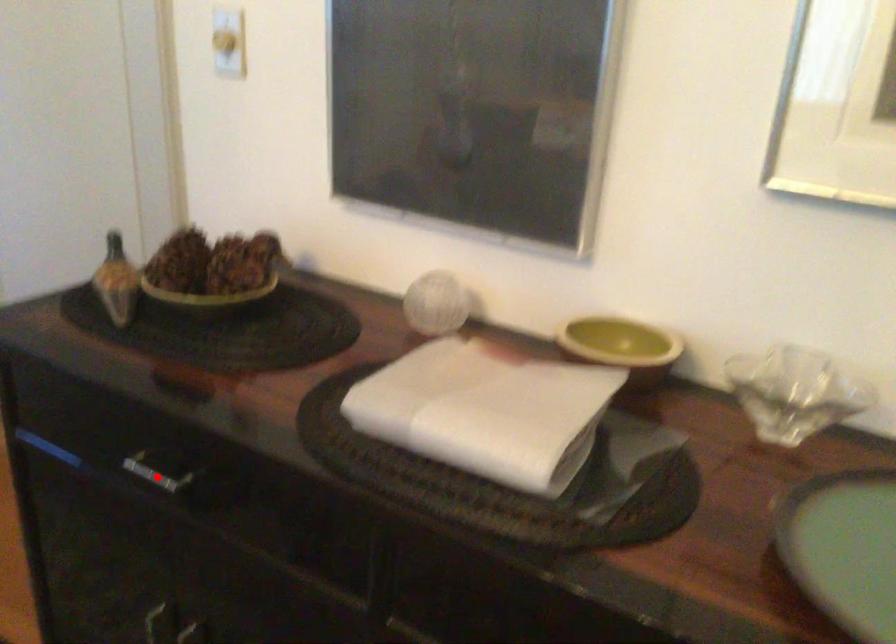
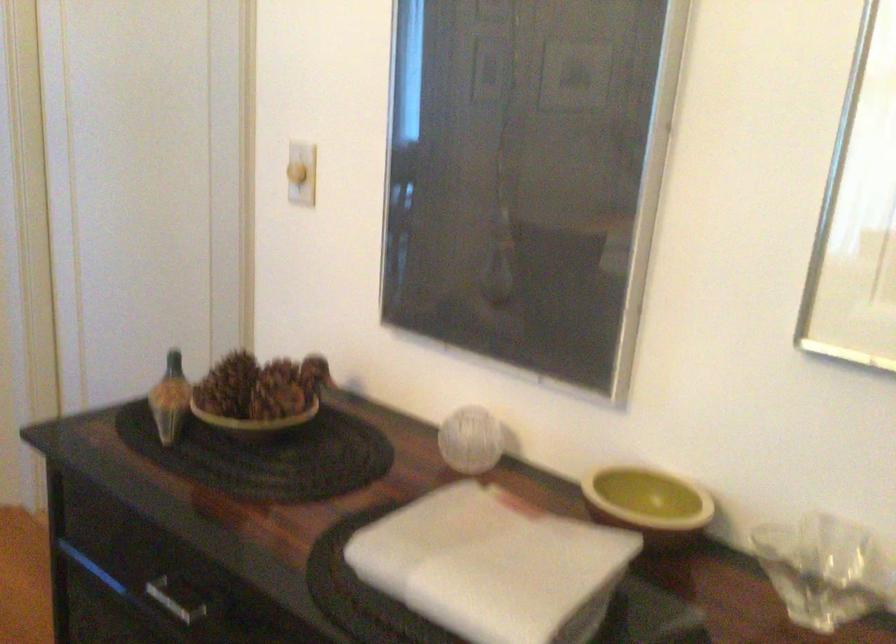
Where in the second image is the point corresponding to the highlighted location from the first image?

(177, 598)